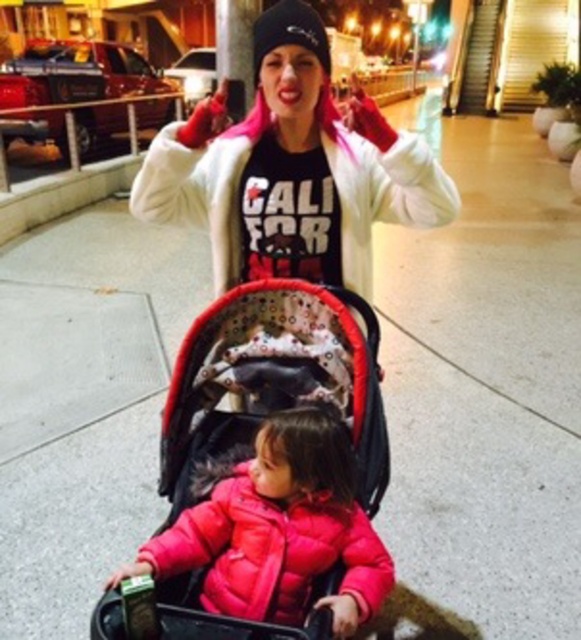
Who is more distant from viewer, (x=277, y=4) or (x=227, y=362)?

Point (x=277, y=4)

Can you confirm if matte white coat at center is wider than red fabric baby carriage at center?

Indeed, matte white coat at center has a greater width compared to red fabric baby carriage at center.

Which is in front, point (293, 148) or point (211, 448)?

Point (211, 448) is in front.

Image resolution: width=581 pixels, height=640 pixels. Find the location of `matte white coat at center`. matte white coat at center is located at coordinates (292, 168).

Find the location of a particular element. red fabric baby carriage at center is located at coordinates (272, 381).

What do you see at coordinates (272, 381) in the screenshot? I see `red fabric baby carriage at center` at bounding box center [272, 381].

I want to click on red fabric baby carriage at center, so click(x=272, y=381).

Is point (432, 189) behind point (385, 561)?

That is True.

Who is shorter, matte white coat at center or matte pink puffer jacket at center?

matte pink puffer jacket at center

Does point (311, 99) come closer to viewer compared to point (382, 595)?

No, (311, 99) is behind (382, 595).

Where is `matte white coat at center`? This screenshot has width=581, height=640. matte white coat at center is located at coordinates (292, 168).